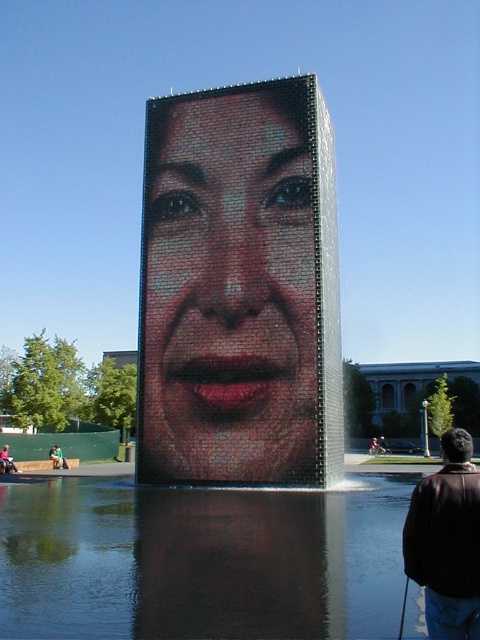
Locate an element on the screen. The height and width of the screenshot is (640, 480). smooth mosaic face at center is located at coordinates (228, 291).

In the scene shown: Is smooth mosaic face at center to the right of transparent glass water at center from the viewer's perspective?

Incorrect, smooth mosaic face at center is not on the right side of transparent glass water at center.

Does point (154, 401) come in front of point (167, 616)?

No, it is not.

Find the location of a particular element. The height and width of the screenshot is (640, 480). smooth mosaic face at center is located at coordinates (228, 291).

Between point (354, 509) and point (456, 456), which one is positioned behind?

Point (354, 509)

You are a GUI agent. You are given a task and a screenshot of the screen. Output one action in this format:
    pyautogui.click(x=<x>, y=<y>)
    Task: Click on the transparent glass water at center
    Image resolution: width=480 pixels, height=640 pixels.
    Given the screenshot: What is the action you would take?
    pyautogui.click(x=200, y=561)

Is point (103, 632) closer to camera compared to point (415, 490)?

That is True.

Locate an element on the screen. This screenshot has height=640, width=480. transparent glass water at center is located at coordinates (200, 561).

In the scene shown: Is smooth mosaic face at center thinner than brown leather jacket at lower right?

Incorrect, smooth mosaic face at center's width is not less than brown leather jacket at lower right's.

Where is `smooth mosaic face at center`? smooth mosaic face at center is located at coordinates (228, 291).

The width and height of the screenshot is (480, 640). Find the location of `smooth mosaic face at center`. smooth mosaic face at center is located at coordinates (228, 291).